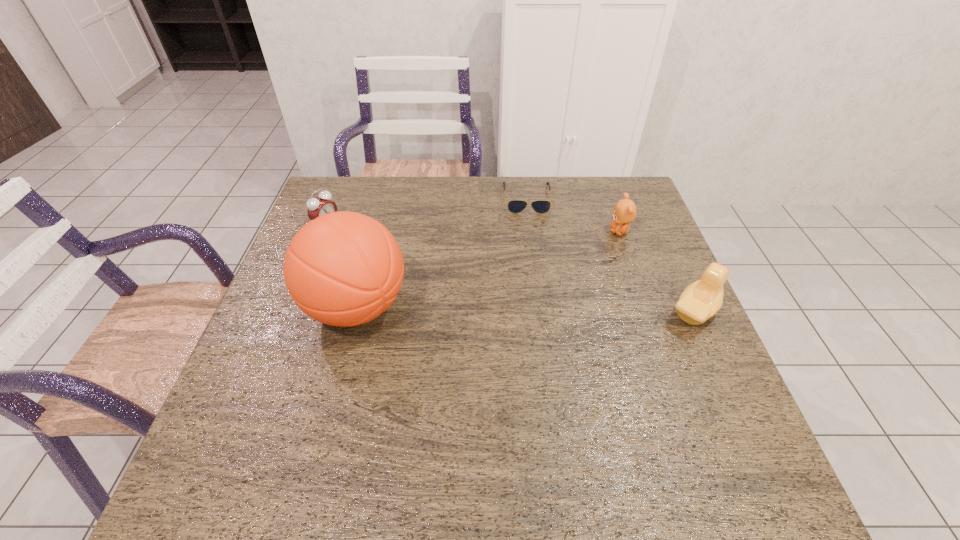
The width and height of the screenshot is (960, 540). Identify the location of duck at the right edge. (702, 299).

Find the location of a particular element. The height and width of the screenshot is (540, 960). teddy bear situated at the right edge is located at coordinates (624, 212).

The image size is (960, 540). I want to click on object that is positioned at the far left corner, so click(x=320, y=205).

At what (x,y) coordinates should I click in order to perform the action: click on free region at the far edge. Please return your answer as a coordinate pair (x, y). This screenshot has width=960, height=540. Looking at the image, I should click on (434, 199).

The image size is (960, 540). I want to click on vacant space at the near edge, so click(x=563, y=397).

Image resolution: width=960 pixels, height=540 pixels. What are the coordinates of `vacant position at the left edge of the desktop` in the screenshot? It's located at coord(283,310).

I want to click on vacant space at the right edge of the desktop, so click(674, 293).

You are a GUI agent. You are given a task and a screenshot of the screen. Output one action in this format:
    pyautogui.click(x=<x>, y=<y>)
    Task: Click on the free space at the far left corner of the desktop
    
    Given the screenshot: What is the action you would take?
    tap(363, 208)

In the image, there is a desktop. Where is `free space at the near left corner`? free space at the near left corner is located at coordinates (273, 434).

At what (x,y) coordinates should I click in order to perform the action: click on unoccupied position between the sunglasses and the alarm clock. Please return your answer as a coordinate pair (x, y). Looking at the image, I should click on (427, 211).